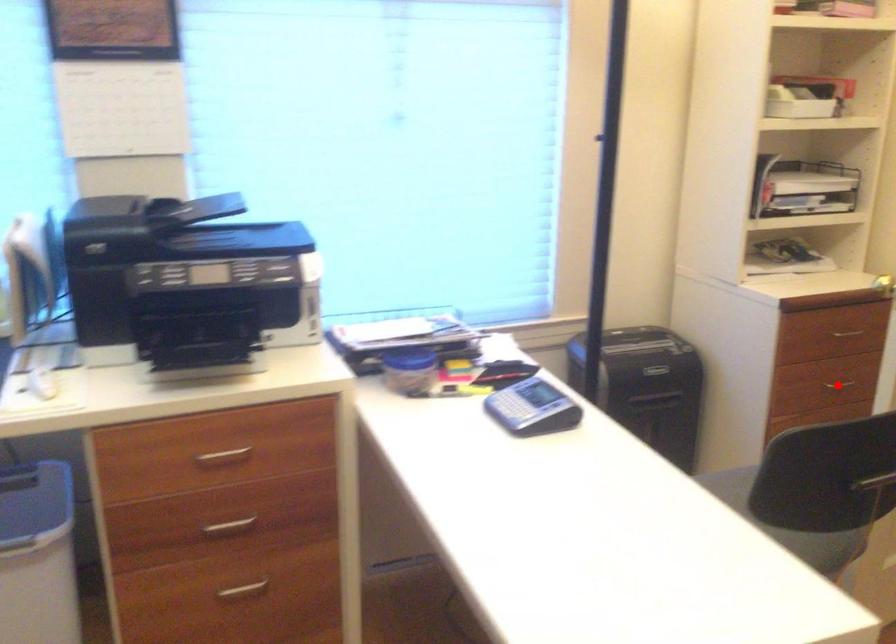
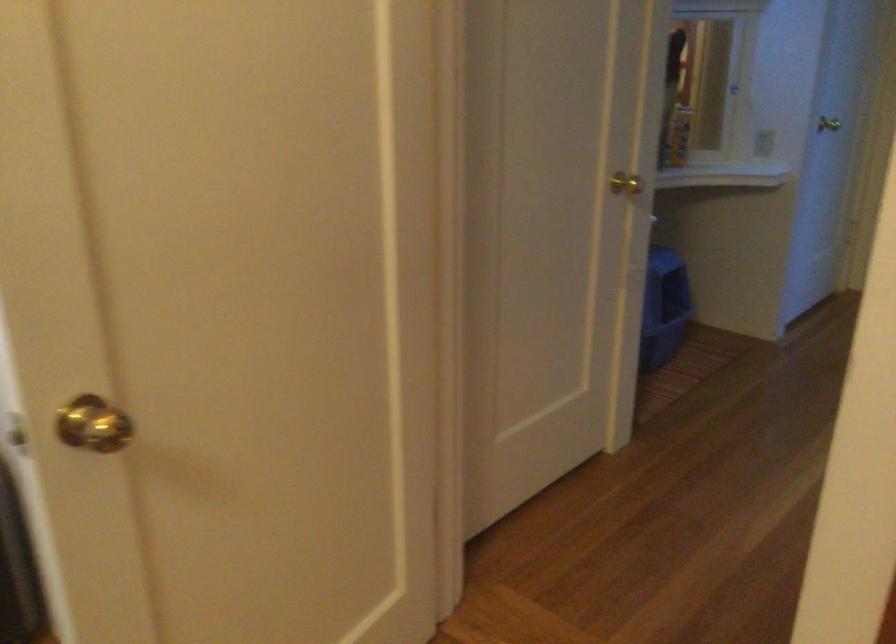
Question: I am providing you with two images of the same scene from different viewpoints. A red point is marked on the first image. Is the red point's position out of view in image 2?

Choices:
 (A) Yes
 (B) No

Answer: (A)